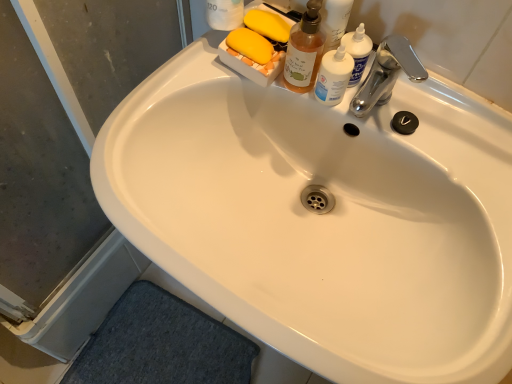
Identify the location of free point to the right of translucent plastic bottle at upper right. (448, 138).